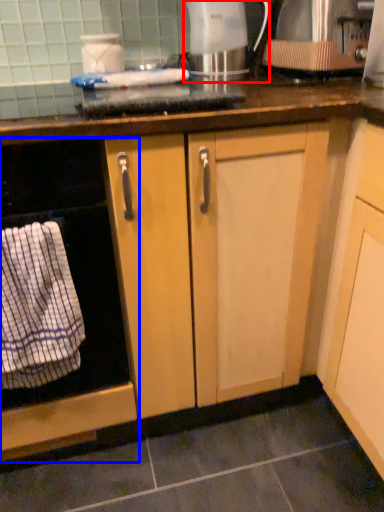
Question: Which of the following is the farthest to the observer, kitchen appliance (highlighted by a red box) or home appliance (highlighted by a blue box)?

Choices:
 (A) kitchen appliance
 (B) home appliance

Answer: (A)